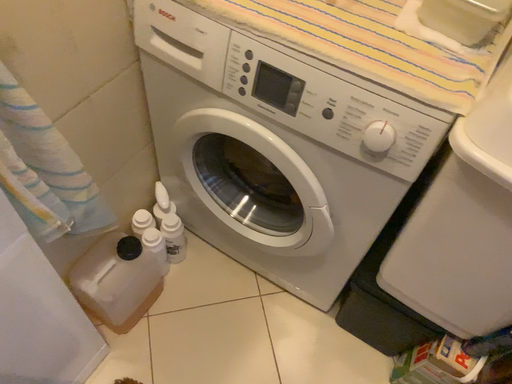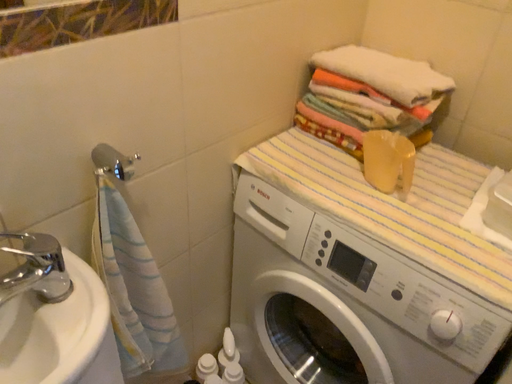
Question: How did the camera likely rotate when shooting the video?

Choices:
 (A) rotated upward
 (B) rotated downward

Answer: (A)